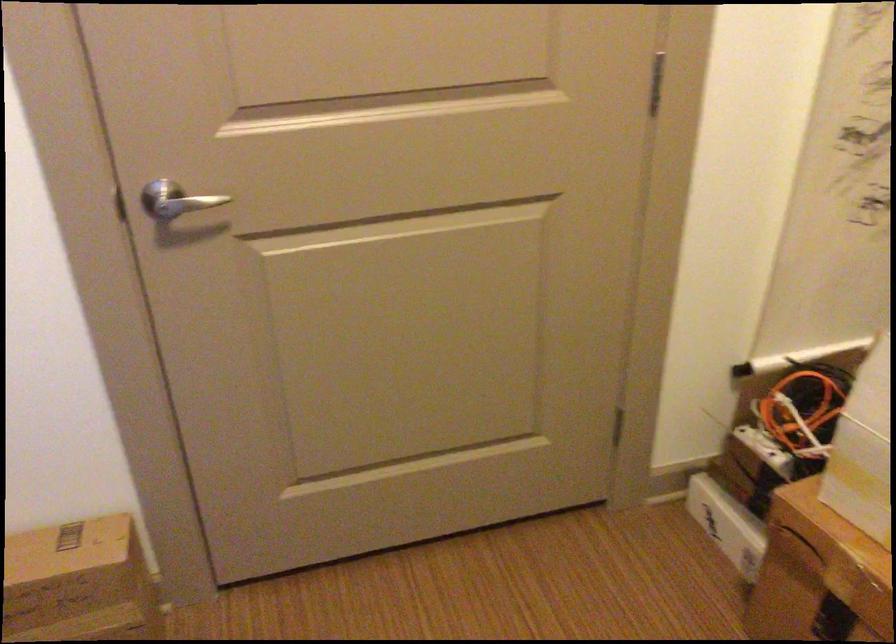
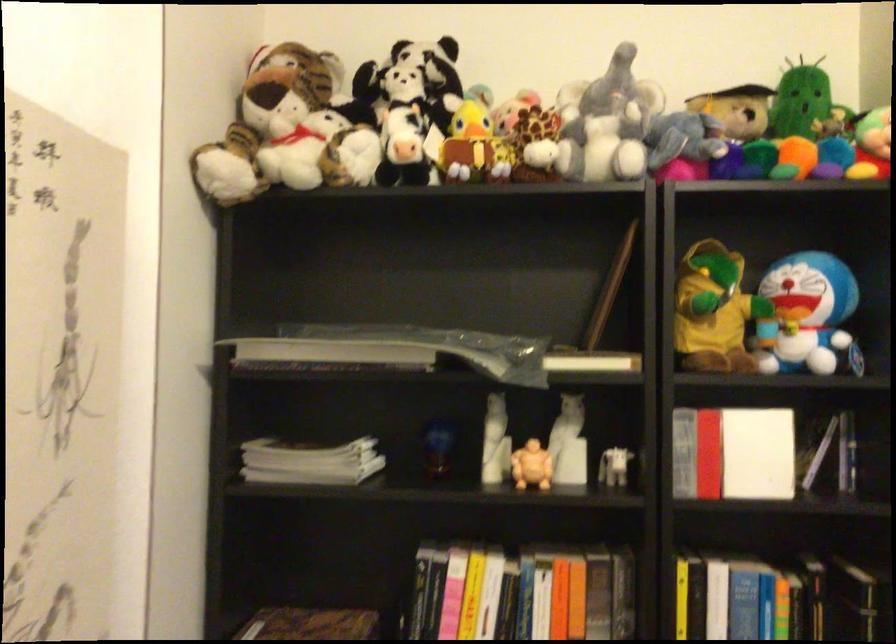
Based on the continuous images, in which direction is the camera rotating?

The camera's rotation is toward right-up.